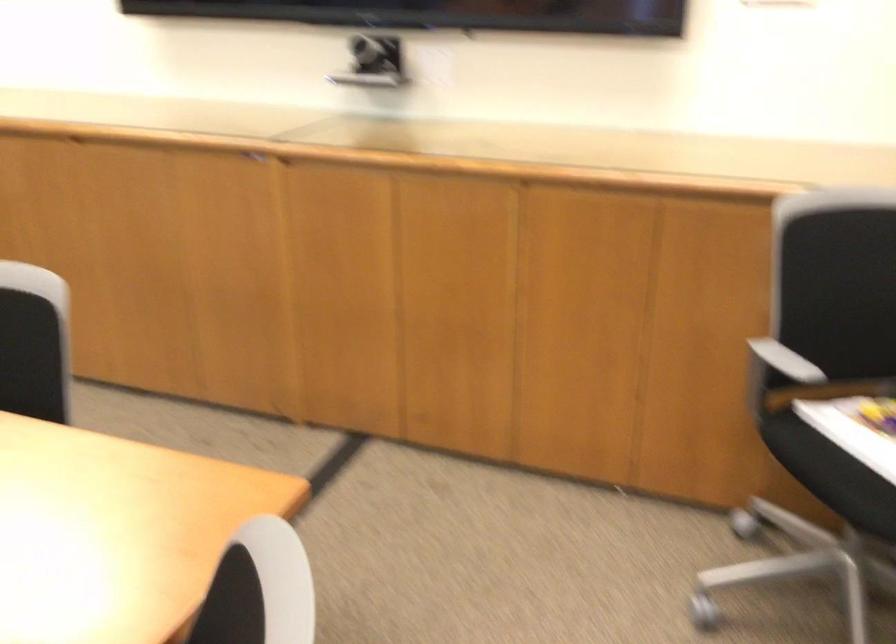
The image size is (896, 644). What are the coordinates of `chair armrest` in the screenshot? It's located at (778, 374).